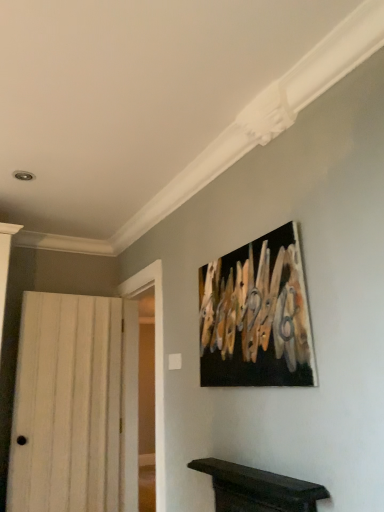
Question: Is the depth of white wood door at left greater than that of black canvas painting at upper center?

Choices:
 (A) yes
 (B) no

Answer: (A)

Question: Does white wood door at left have a greater height compared to black canvas painting at upper center?

Choices:
 (A) no
 (B) yes

Answer: (B)

Question: Does white wood door at left have a smaller size compared to black canvas painting at upper center?

Choices:
 (A) no
 (B) yes

Answer: (A)

Question: Does white wood door at left have a lesser width compared to black canvas painting at upper center?

Choices:
 (A) no
 (B) yes

Answer: (A)

Question: Does white wood door at left appear on the right side of black canvas painting at upper center?

Choices:
 (A) yes
 (B) no

Answer: (B)

Question: From a real-world perspective, is white wood door at left on top of black canvas painting at upper center?

Choices:
 (A) no
 (B) yes

Answer: (A)

Question: From the image's perspective, is black canvas painting at upper center on top of white wood door at left?

Choices:
 (A) no
 (B) yes

Answer: (B)

Question: Is black canvas painting at upper center to the left of white wood door at left from the viewer's perspective?

Choices:
 (A) yes
 (B) no

Answer: (B)

Question: Does black canvas painting at upper center turn towards white wood door at left?

Choices:
 (A) yes
 (B) no

Answer: (B)

Question: Can you confirm if black canvas painting at upper center is bigger than white wood door at left?

Choices:
 (A) yes
 (B) no

Answer: (B)

Question: Is black canvas painting at upper center further to camera compared to white wood door at left?

Choices:
 (A) no
 (B) yes

Answer: (A)

Question: Considering the relative positions of black canvas painting at upper center and white wood door at left in the image provided, is black canvas painting at upper center in front of white wood door at left?

Choices:
 (A) yes
 (B) no

Answer: (A)

Question: Relative to white wood door at left, is black canvas painting at upper center in front or behind?

Choices:
 (A) behind
 (B) front

Answer: (B)